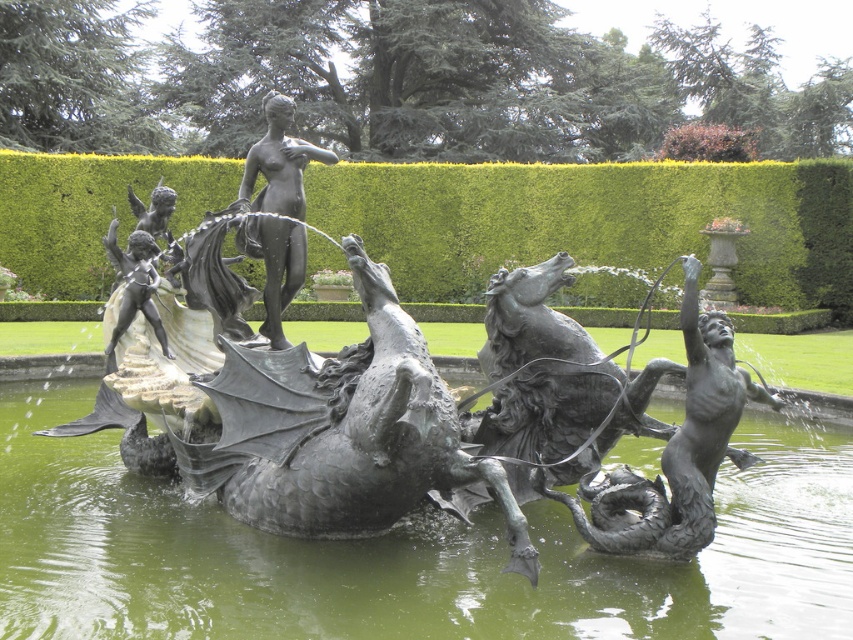
You are a landscape architect designing a new garden. You need to place a new decorative bench that must be placed on the side of the bronze statue at center that is opposite to the green metallic water at center. Which side should you place the bench?

The green metallic water at center is wider than the bronze statue at center, so the bench should be placed on the side of the bronze statue at center that is opposite to the green metallic water at center.

Please look at the point marked at coordinates (676, 451). What object is located there?

The point at coordinates (676, 451) corresponds to the polished bronze man at center.

You are an art curator planning to move the polished bronze man at center and the bronze statue at center into a new exhibition hall. The hall has a 2 meter wide entrance. Can both objects pass through the entrance without rotating them? Please explain your reasoning.

The polished bronze man at center is narrower than the bronze statue at center. Since the entrance is 2 meters wide, we need to know the exact width of the bronze statue at center. However, the description only states that the polished bronze man at center is narrower. Without knowing the bronze statue at center width, we cannot confirm if it will fit through the 2 meter entrance.